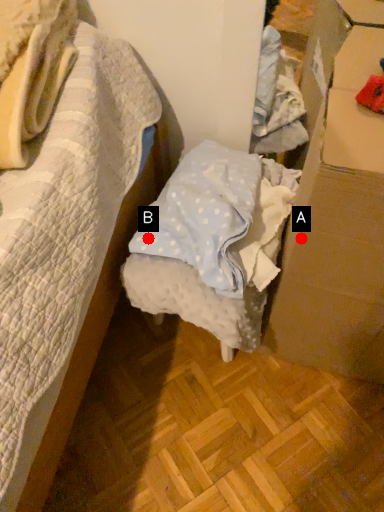
Question: Two points are circled on the image, labeled by A and B beside each circle. Among these points, which one is nearest to the camera?

Choices:
 (A) A is closer
 (B) B is closer

Answer: (A)